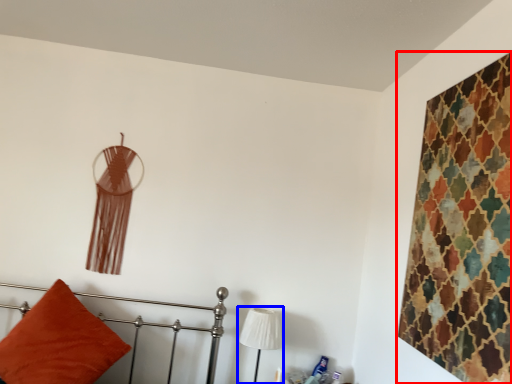
Question: Among these objects, which one is nearest to the camera, textile (highlighted by a red box) or table lamp (highlighted by a blue box)?

Choices:
 (A) textile
 (B) table lamp

Answer: (A)